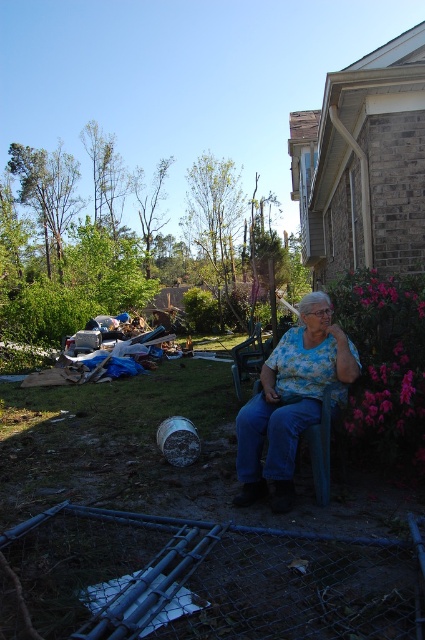
You are a delivery person who needs to place a small package between the floral print blouse at center and the matte plastic chair at center. The package requires a space of 2 meters. Is there enough space between them to place the package?

The distance between the floral print blouse at center and the matte plastic chair at center is 2.45 meters, which is more than the required 2 meters. Therefore, there is enough space to place the package between them.

You are a photographer trying to capture a portrait of the person in the scene. The floral print blouse at center and the matte plastic chair at center are both in the frame. To ensure the subject is centered, which object should you adjust your focus towards?

The floral print blouse at center is to the right of the matte plastic chair at center, so to center the subject, focus should be adjusted towards the left to balance the position of the floral print blouse at center relative to the matte plastic chair at center.